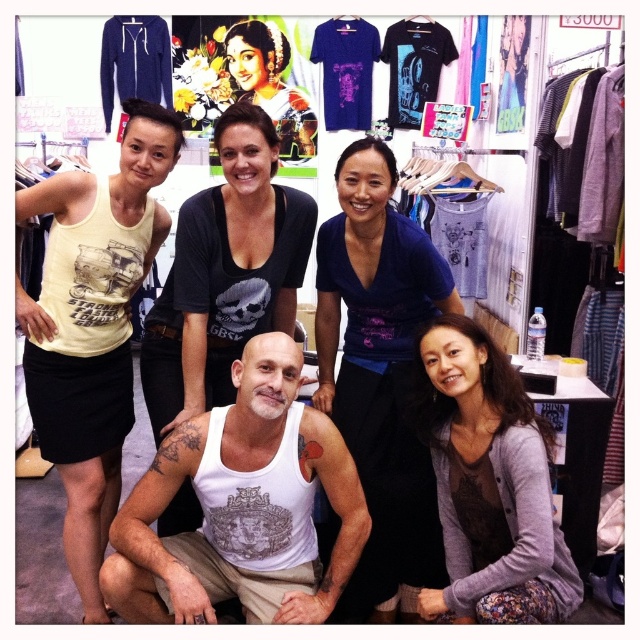
In the scene shown: Where is the white cotton tank top at center located in the image?

The white cotton tank top at center is located at point (241,506).

You are standing at the point marked as point [387,488] and want to greet someone who is 6.67 feet away. Which direction should you walk to reach them?

The person is 6.67 feet away from point [387,488], but without additional information about their relative position, I cannot determine the exact direction to walk.

You are a photographer setting up for a group photo in a clothing store. You have two tank tops on display at the center of the scene, the white cotton tank top at center and the matte black tank top at center. You need to position the group members so that they are exactly 40 centimeters apart from each other. Can the existing spacing between the two tank tops help you determine if the group members can be positioned at the required distance?

The distance between the white cotton tank top at center and the matte black tank top at center is 35.61 centimeters. Since the required spacing between group members is 40 centimeters, the existing distance is shorter than needed. Therefore, the group members cannot be positioned at the required 40 centimeter distance using the spacing between the two tank tops.